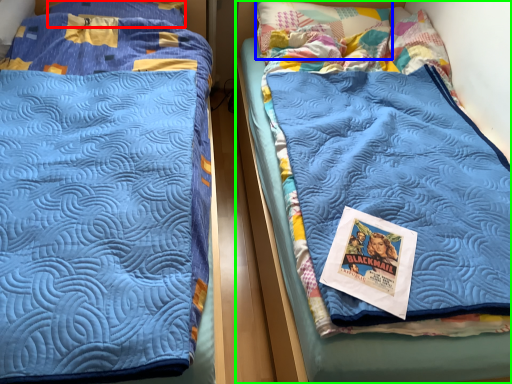
Question: Which object is the farthest from pillow (highlighted by a red box)? Choose among these: pillow (highlighted by a blue box) or bed (highlighted by a green box).

Choices:
 (A) pillow
 (B) bed

Answer: (B)